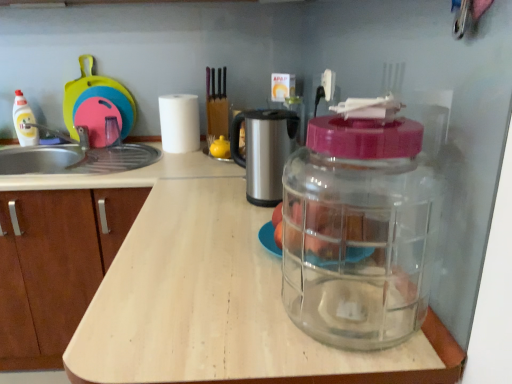
The width and height of the screenshot is (512, 384). I want to click on vacant area in front of stainless steel coffee maker at center, so click(x=241, y=220).